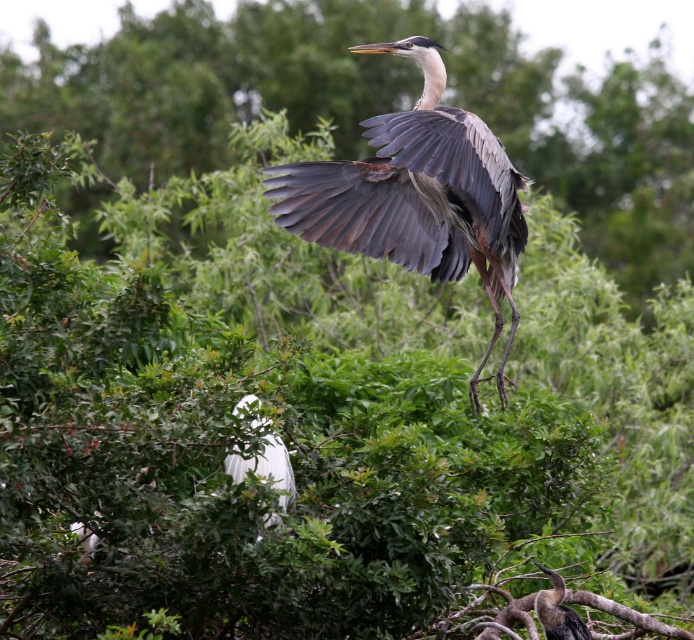
Is gray feathered heron at center taller than white feathered bird at center?

Correct, gray feathered heron at center is much taller as white feathered bird at center.

Is gray feathered heron at center to the right of white feathered bird at center from the viewer's perspective?

Correct, you'll find gray feathered heron at center to the right of white feathered bird at center.

Find the location of a particular element. This screenshot has width=694, height=640. gray feathered heron at center is located at coordinates (418, 195).

Is white feathered bird at center smaller than dark brown feathers at center?

No, white feathered bird at center is not smaller than dark brown feathers at center.

Is white feathered bird at center further to the viewer compared to dark brown feathers at center?

That is False.

Find the location of a particular element. This screenshot has height=640, width=694. white feathered bird at center is located at coordinates (266, 468).

Does point (518, 218) come closer to viewer compared to point (550, 628)?

No, it is not.

The height and width of the screenshot is (640, 694). Find the location of `gray feathered heron at center`. gray feathered heron at center is located at coordinates (418, 195).

Between point (278, 218) and point (539, 602), which one is positioned in front?

Positioned in front is point (539, 602).

Identify the location of gray feathered heron at center. (x=418, y=195).